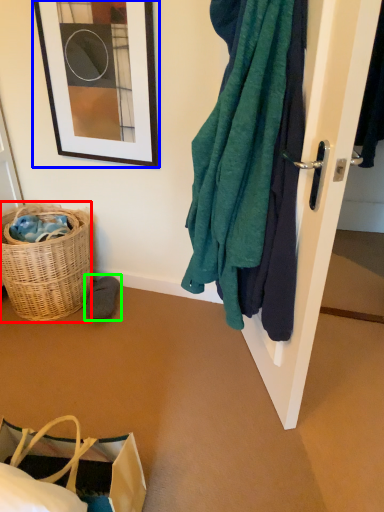
Question: Which is nearer to the picnic basket (highlighted by a red box)? picture frame (highlighted by a blue box) or footwear (highlighted by a green box).

Choices:
 (A) picture frame
 (B) footwear

Answer: (B)